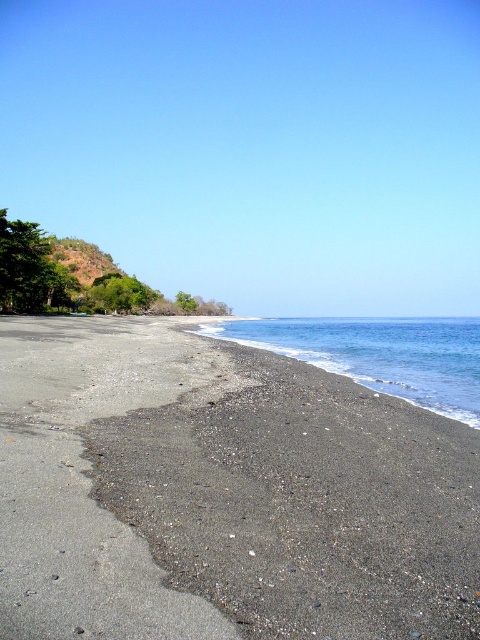
You are standing on the beach and want to walk to the blue smooth water at center without stepping on the dark gray sand at lower left. Is it possible to do so?

The dark gray sand at lower left is smaller than the blue smooth water at center, so yes, you can walk to the blue smooth water at center without stepping on the dark gray sand at lower left by avoiding its smaller area.